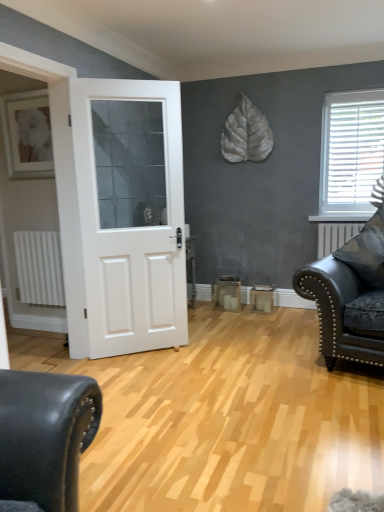
Where is `vacant area that is situated to the right of white matte door at center`? vacant area that is situated to the right of white matte door at center is located at coordinates (206, 352).